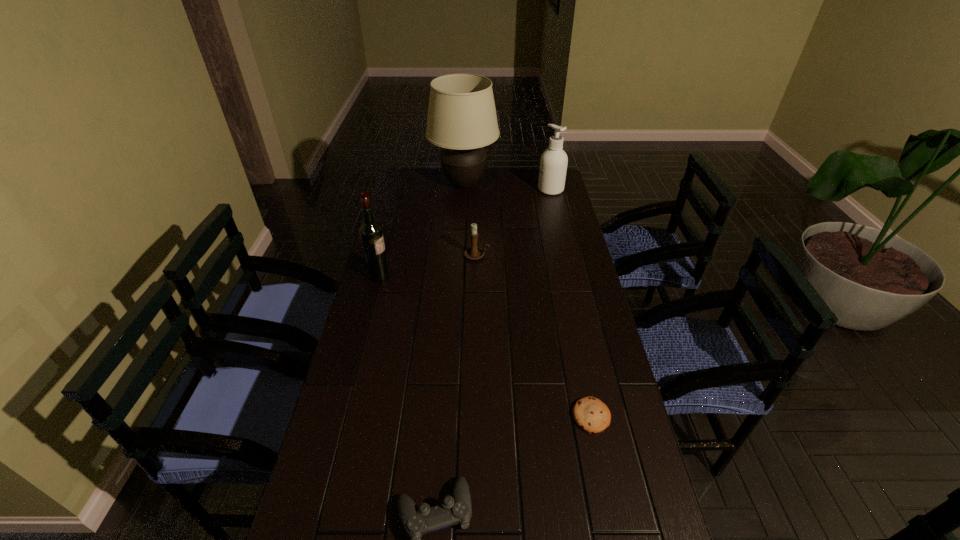
This screenshot has width=960, height=540. In order to click on cookie that is at the right edge in this screenshot , I will do `click(590, 414)`.

You are a GUI agent. You are given a task and a screenshot of the screen. Output one action in this format:
    pyautogui.click(x=<x>, y=<y>)
    Task: Click on the object located at the far left corner
    
    Given the screenshot: What is the action you would take?
    pyautogui.click(x=462, y=119)

At what (x,y) coordinates should I click in order to perform the action: click on object located at the far right corner. Please return your answer as a coordinate pair (x, y). The width and height of the screenshot is (960, 540). Looking at the image, I should click on (553, 165).

You are a GUI agent. You are given a task and a screenshot of the screen. Output one action in this format:
    pyautogui.click(x=<x>, y=<y>)
    Task: Click on the vacant space at the left edge of the desktop
    This screenshot has width=960, height=540.
    Given the screenshot: What is the action you would take?
    pyautogui.click(x=410, y=250)

I want to click on free space at the right edge of the desktop, so pos(540,219).

In the image, there is a desktop. Identify the location of free space at the far left corner. (417, 186).

The width and height of the screenshot is (960, 540). I want to click on vacant space that is in between the fourth tallest object and the lampshade, so click(470, 220).

The width and height of the screenshot is (960, 540). Find the location of `empty space that is in between the third farthest object and the leftmost object`. empty space that is in between the third farthest object and the leftmost object is located at coordinates (428, 266).

I want to click on vacant area between the leftmost object and the third farthest object, so click(428, 266).

I want to click on empty space that is in between the fifth farthest object and the wine bottle, so click(486, 346).